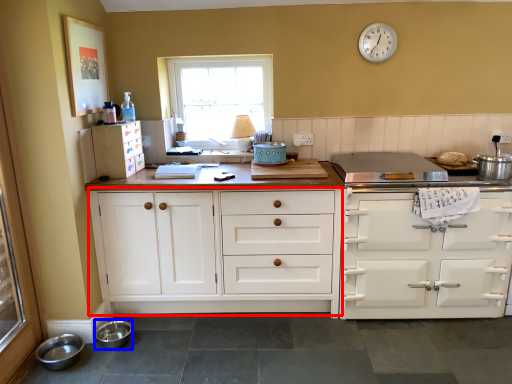
Question: Which object is further to the camera taking this photo, cabinetry (highlighted by a red box) or bowl (highlighted by a blue box)?

Choices:
 (A) cabinetry
 (B) bowl

Answer: (A)